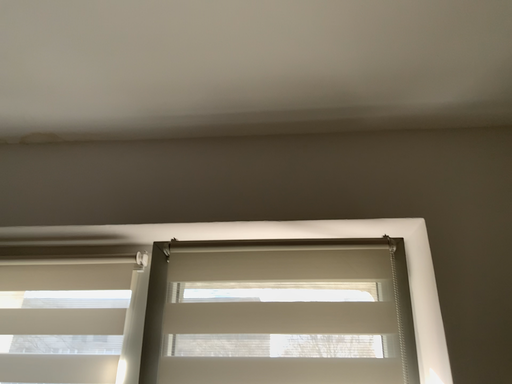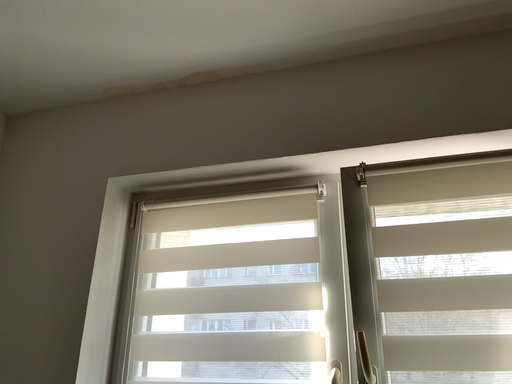
Question: How did the camera likely rotate when shooting the video?

Choices:
 (A) rotated upward
 (B) rotated downward

Answer: (B)